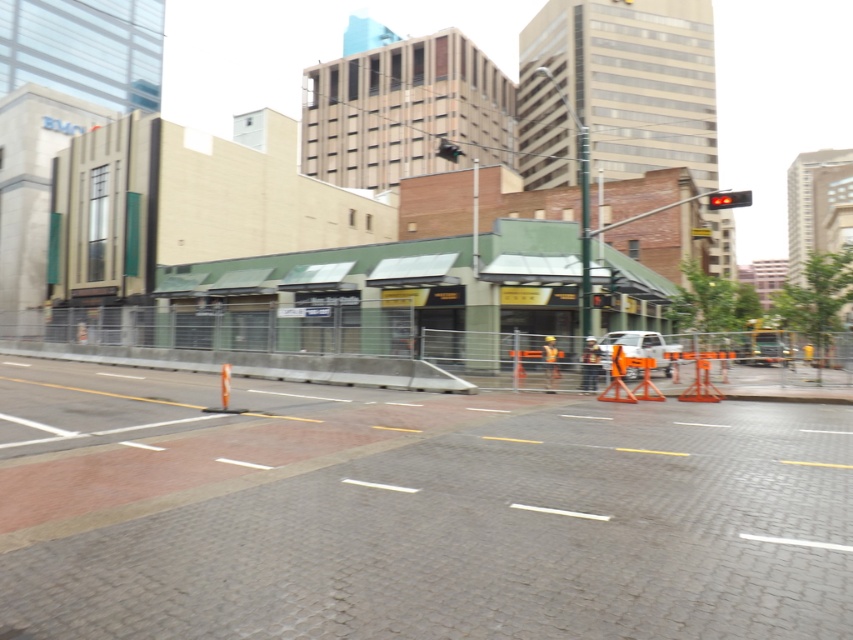
Which of these two, brick pavement at center or white matte truck at center, stands taller?

Standing taller between the two is white matte truck at center.

Does brick pavement at center have a smaller size compared to white matte truck at center?

Correct, brick pavement at center occupies less space than white matte truck at center.

Between point (512, 548) and point (602, 340), which one is positioned in front?

Point (512, 548)

The image size is (853, 640). In order to click on brick pavement at center in this screenshot , I will do `click(415, 513)`.

Between red plastic traffic light at upper right and red plastic traffic light at center, which one appears on the right side from the viewer's perspective?

From the viewer's perspective, red plastic traffic light at upper right appears more on the right side.

From the picture: Is red plastic traffic light at upper right wider than red plastic traffic light at center?

Correct, the width of red plastic traffic light at upper right exceeds that of red plastic traffic light at center.

Between point (737, 202) and point (595, 298), which one is positioned behind?

The point (595, 298) is behind.

Image resolution: width=853 pixels, height=640 pixels. Find the location of `red plastic traffic light at upper right`. red plastic traffic light at upper right is located at coordinates (728, 198).

Looking at this image, does white matte truck at center appear on the right side of red plastic traffic light at upper right?

No, white matte truck at center is not to the right of red plastic traffic light at upper right.

Looking at this image, is white matte truck at center below red plastic traffic light at upper right?

Indeed, white matte truck at center is positioned under red plastic traffic light at upper right.

Looking at this image, who is more distant from viewer, (630, 349) or (741, 196)?

Positioned behind is point (630, 349).

Locate an element on the screen. white matte truck at center is located at coordinates (637, 348).